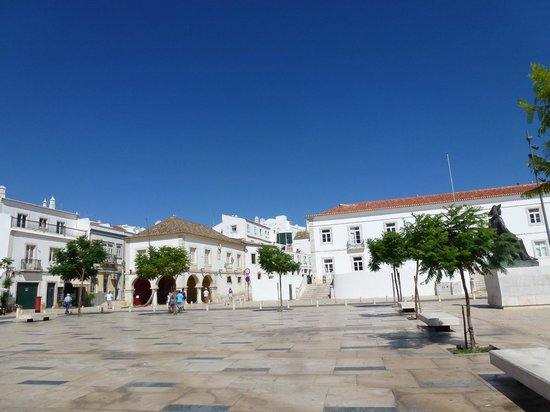
This screenshot has height=412, width=550. Find the location of `staircase`. staircase is located at coordinates (315, 291).